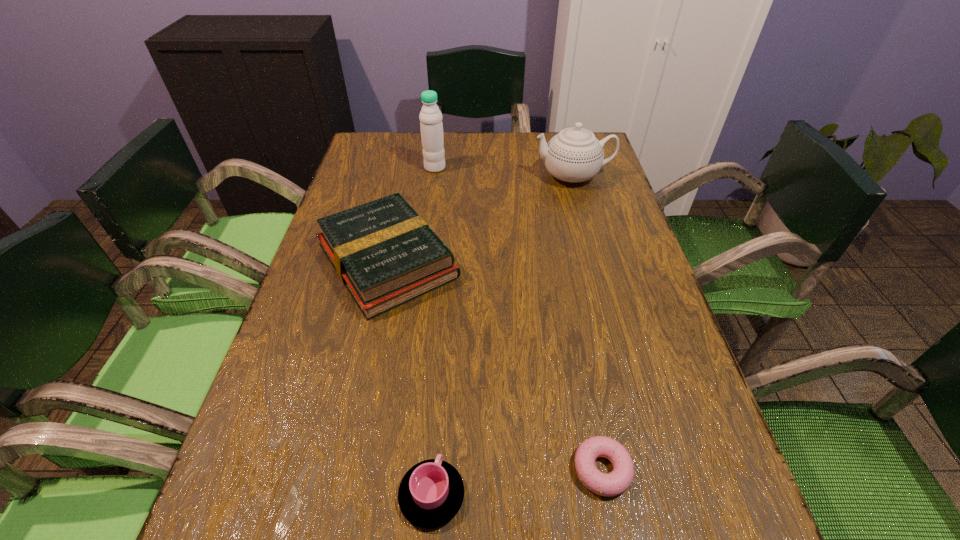
I want to click on vacant area that lies between the chinaware and the third shortest object, so click(x=480, y=218).

Find the location of a particular element. The height and width of the screenshot is (540, 960). vacant space that's between the fourth tallest object and the hardback book is located at coordinates (410, 378).

Identify the location of free space between the fourth shortest object and the tallest object. (504, 172).

The height and width of the screenshot is (540, 960). In order to click on unoccupied area between the fourth shortest object and the third tallest object in this screenshot , I will do `click(480, 218)`.

Where is `object that stands as the second closest to the third tallest object`? object that stands as the second closest to the third tallest object is located at coordinates (574, 155).

At what (x,y) coordinates should I click in order to perform the action: click on the third closest object to the third farthest object. Please return your answer as a coordinate pair (x, y). Looking at the image, I should click on (431, 493).

This screenshot has width=960, height=540. In order to click on vacant point that satisfies the following two spatial constraints: 1. on the side with the handle of the fourth tallest object; 2. on the right side of the doughnut in this screenshot , I will do `click(434, 469)`.

Image resolution: width=960 pixels, height=540 pixels. I want to click on free point that satisfies the following two spatial constraints: 1. on the front side of the third nearest object; 2. on the left side of the doughnut, so click(x=342, y=469).